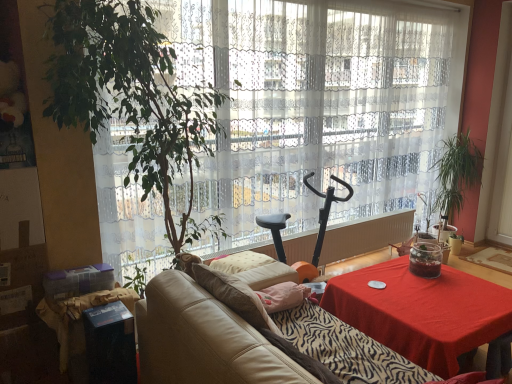
At what (x,y) coordinates should I click in order to perform the action: click on free space above red cloth-covered table at lower right (from a real-world perspective). Please return your answer as a coordinate pair (x, y). This screenshot has height=384, width=512. Looking at the image, I should click on (432, 294).